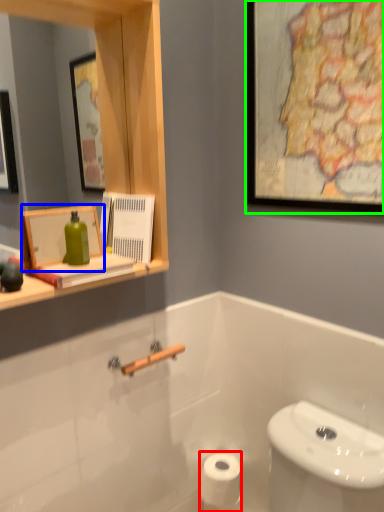
Question: Which object is positioned closest to toilet paper (highlighted by a red box)? Select from picture frame (highlighted by a blue box) and picture frame (highlighted by a green box).

Choices:
 (A) picture frame
 (B) picture frame

Answer: (A)